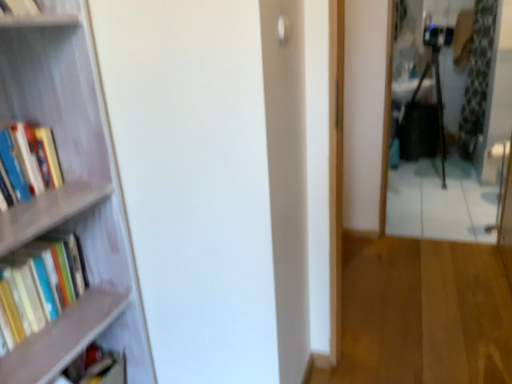
Question: Is hardcover books at left, which ranks as the first book in top-to-bottom order, spatially inside hardcover books at left, which ranks as the 2th book in top-to-bottom order, or outside of it?

Choices:
 (A) inside
 (B) outside

Answer: (B)

Question: Looking at their shapes, would you say hardcover books at left, the 3th book in the bottom-to-top sequence, is wider or thinner than hardcover books at left, which ranks as the 2th book in top-to-bottom order?

Choices:
 (A) wide
 (B) thin

Answer: (A)

Question: Which object is the farthest from the green floral fabric curtain at right?

Choices:
 (A) hardcover books at left, which is the 2th book from bottom to top
 (B) matte black book at lower left, which is the third book from top to bottom
 (C) hardcover books at left, the 3th book in the bottom-to-top sequence
 (D) metallic reflective mirror at right
 (E) wooden bookshelf at left

Answer: (B)

Question: Considering the real-world distances, which object is closest to the wooden floor at center?

Choices:
 (A) wooden bookshelf at left
 (B) metallic reflective mirror at right
 (C) hardcover books at left, the 3th book in the bottom-to-top sequence
 (D) green floral fabric curtain at right
 (E) hardcover books at left, which is the 2th book from bottom to top

Answer: (B)